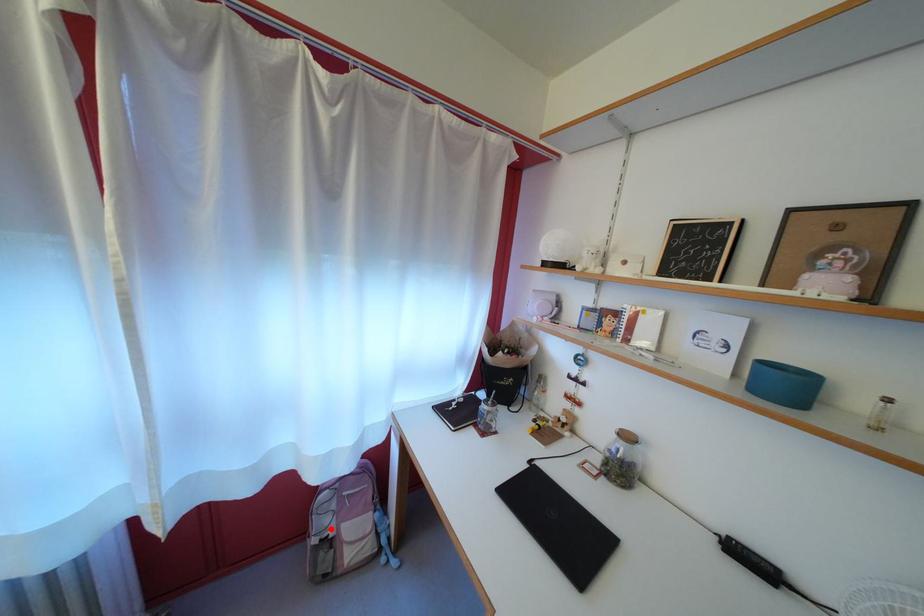
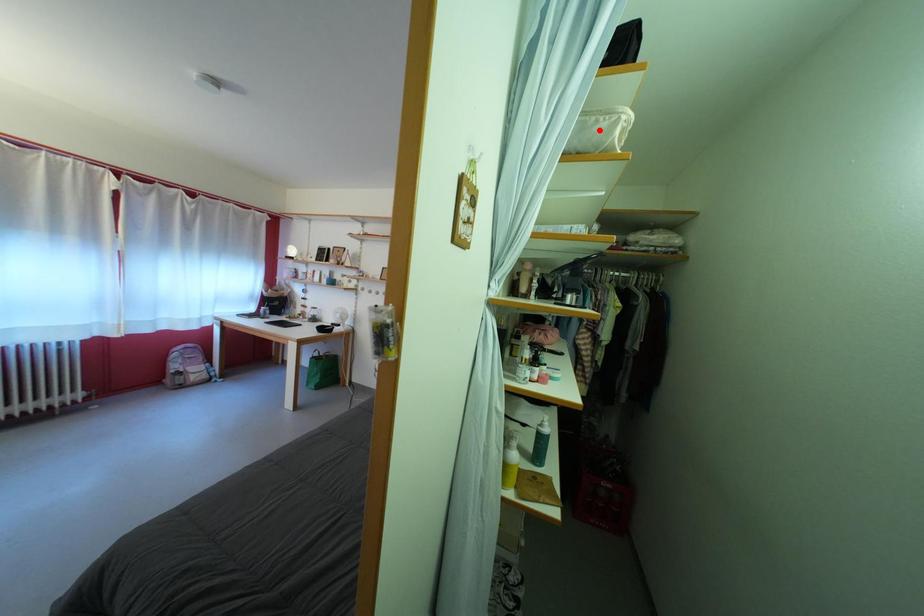
I am providing you with two images of the same scene from different viewpoints. A red point is marked on the first image and another point is marked on the second image. Is the marked point in image1 the same physical position as the marked point in image2?

No